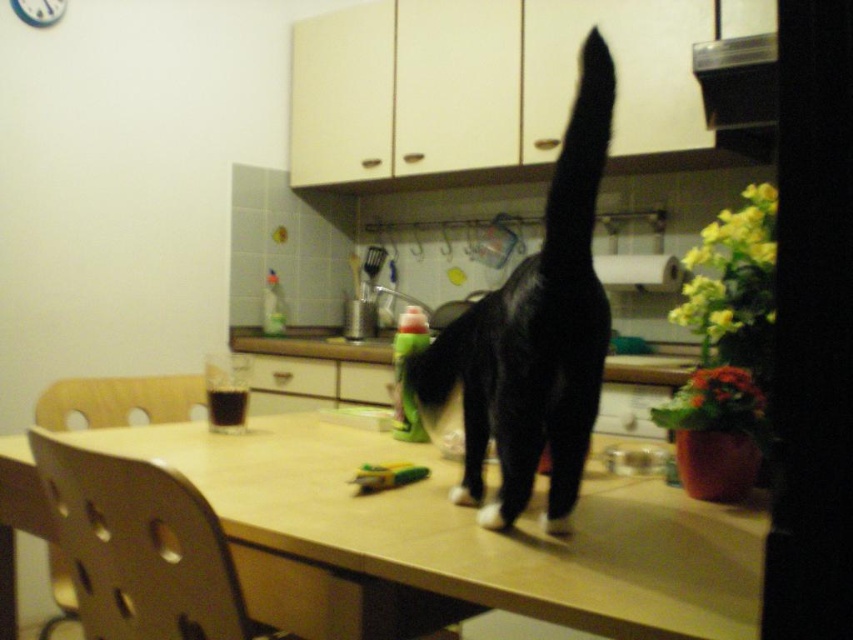
Is point (764, 528) in front of point (558, 228)?

No.

Can you confirm if light brown wooden table at center is positioned to the right of black fur cat at center?

Incorrect, light brown wooden table at center is not on the right side of black fur cat at center.

Which is in front, point (347, 461) or point (491, 316)?

Point (491, 316) is in front.

In order to click on light brown wooden table at center in this screenshot , I will do `click(473, 529)`.

Is the position of light brown wooden table at center less distant than that of black matte tail at upper center?

Yes.

Is light brown wooden table at center wider than black matte tail at upper center?

Correct, the width of light brown wooden table at center exceeds that of black matte tail at upper center.

Which is in front, point (643, 573) or point (589, 160)?

Positioned in front is point (643, 573).

At what (x,y) coordinates should I click in order to perform the action: click on light brown wooden table at center. Please return your answer as a coordinate pair (x, y). The height and width of the screenshot is (640, 853). Looking at the image, I should click on (x=473, y=529).

Does black fur cat at center appear on the right side of black matte tail at upper center?

In fact, black fur cat at center is to the left of black matte tail at upper center.

Is black fur cat at center thinner than black matte tail at upper center?

Incorrect, black fur cat at center's width is not less than black matte tail at upper center's.

The width and height of the screenshot is (853, 640). Describe the element at coordinates (534, 333) in the screenshot. I see `black fur cat at center` at that location.

Where is `black fur cat at center`? Image resolution: width=853 pixels, height=640 pixels. black fur cat at center is located at coordinates (534, 333).